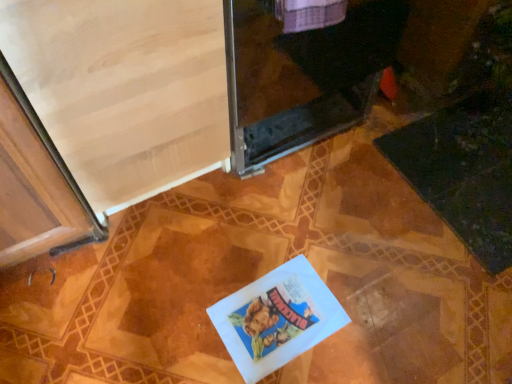
Question: From a real-world perspective, does light wood screen door at upper left, which appears as the second screen door when viewed from the right, sit lower than white paper book at center?

Choices:
 (A) no
 (B) yes

Answer: (A)

Question: Is light wood screen door at upper left, the first screen door positioned from the left, oriented towards white paper book at center?

Choices:
 (A) yes
 (B) no

Answer: (A)

Question: Is light wood screen door at upper left, the first screen door positioned from the left, to the left of white paper book at center from the viewer's perspective?

Choices:
 (A) yes
 (B) no

Answer: (A)

Question: Can you confirm if light wood screen door at upper left, which appears as the second screen door when viewed from the right, is wider than white paper book at center?

Choices:
 (A) no
 (B) yes

Answer: (B)

Question: Is the position of light wood screen door at upper left, which appears as the second screen door when viewed from the right, more distant than that of white paper book at center?

Choices:
 (A) no
 (B) yes

Answer: (A)

Question: From a real-world perspective, is light wood screen door at upper left, the first screen door positioned from the left, above or below transparent glass screen door at upper center, the first screen door when ordered from right to left?

Choices:
 (A) above
 (B) below

Answer: (A)

Question: Is light wood screen door at upper left, which appears as the second screen door when viewed from the right, taller or shorter than transparent glass screen door at upper center, positioned as the second screen door in left-to-right order?

Choices:
 (A) short
 (B) tall

Answer: (B)

Question: In the image, is light wood screen door at upper left, which appears as the second screen door when viewed from the right, on the left side or the right side of transparent glass screen door at upper center, the first screen door when ordered from right to left?

Choices:
 (A) right
 (B) left

Answer: (B)

Question: In the image, is light wood screen door at upper left, the first screen door positioned from the left, positioned in front of or behind transparent glass screen door at upper center, the first screen door when ordered from right to left?

Choices:
 (A) front
 (B) behind

Answer: (A)

Question: Considering the positions of white paper book at center and light wood screen door at upper left, which appears as the second screen door when viewed from the right, in the image, is white paper book at center taller or shorter than light wood screen door at upper left, which appears as the second screen door when viewed from the right,?

Choices:
 (A) tall
 (B) short

Answer: (B)

Question: In terms of width, does white paper book at center look wider or thinner when compared to light wood screen door at upper left, which appears as the second screen door when viewed from the right?

Choices:
 (A) thin
 (B) wide

Answer: (A)

Question: From a real-world perspective, is white paper book at center above or below light wood screen door at upper left, the first screen door positioned from the left?

Choices:
 (A) below
 (B) above

Answer: (A)

Question: Relative to light wood screen door at upper left, which appears as the second screen door when viewed from the right, is white paper book at center in front or behind?

Choices:
 (A) front
 (B) behind

Answer: (B)

Question: Visually, is white paper book at center positioned to the left or to the right of transparent glass screen door at upper center, positioned as the second screen door in left-to-right order?

Choices:
 (A) right
 (B) left

Answer: (A)

Question: Does point (323, 304) appear closer or farther from the camera than point (293, 92)?

Choices:
 (A) closer
 (B) farther

Answer: (A)